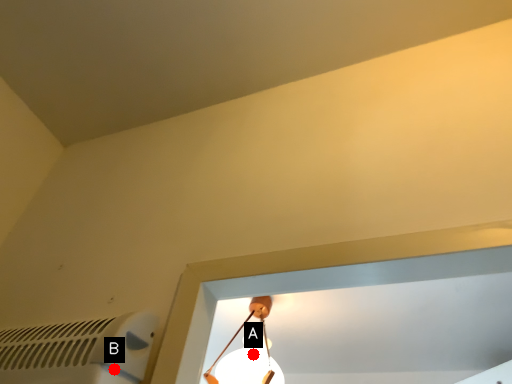
Question: Two points are circled on the image, labeled by A and B beside each circle. Which point appears closest to the camera in this image?

Choices:
 (A) A is closer
 (B) B is closer

Answer: (B)